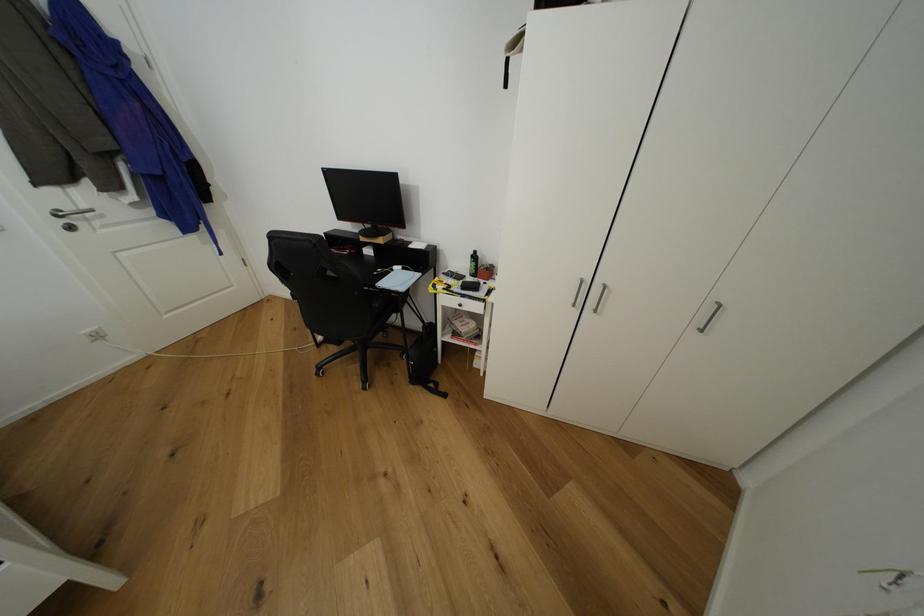
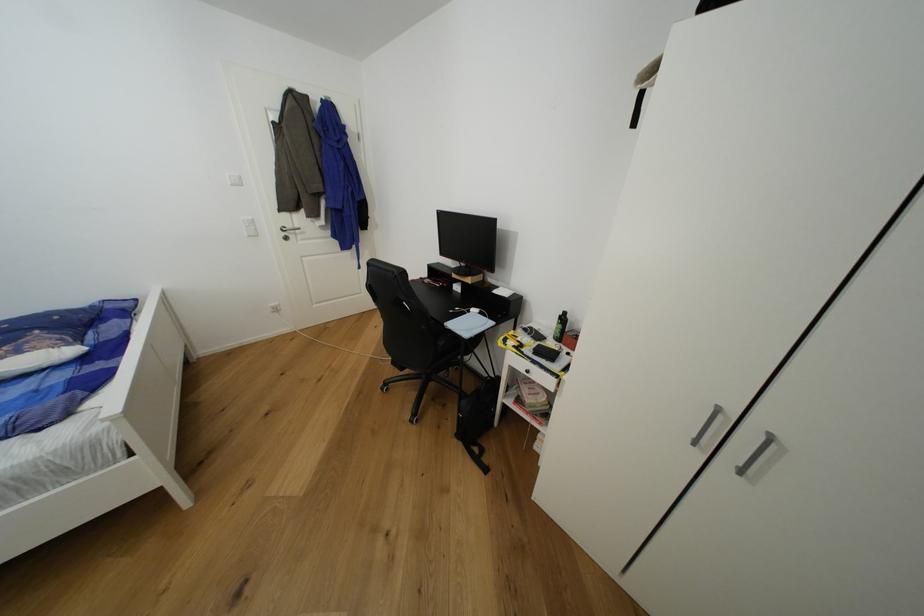
Consider the image. The images are taken continuously from a first-person perspective. In which direction are you moving?

The cameraman moved toward right, forward.